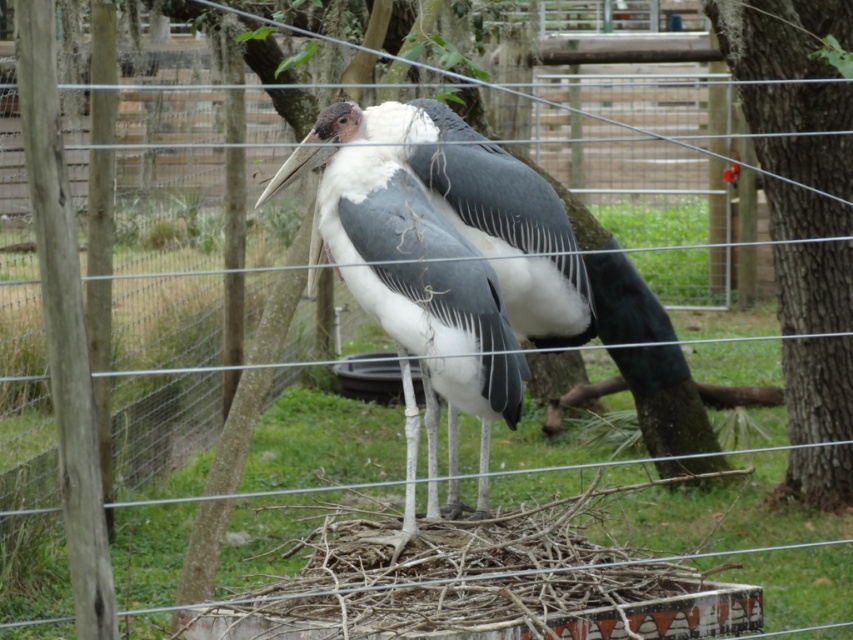
Between white feathered bird at center and smooth bark tree at right, which one has more height?

Standing taller between the two is smooth bark tree at right.

Does white feathered bird at center have a larger size compared to smooth bark tree at right?

Actually, white feathered bird at center might be smaller than smooth bark tree at right.

Which is behind, point (469, 186) or point (778, 100)?

Point (778, 100)

The height and width of the screenshot is (640, 853). What are the coordinates of `white feathered bird at center` in the screenshot? It's located at (410, 269).